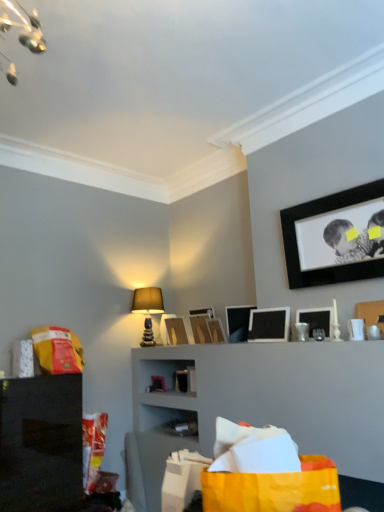
Question: Considering the positions of wooden picture frame at center, the 3th picture frame positioned from the back, and black matte picture frame at upper right, which appears as the eighth picture frame when viewed from the back, in the image, is wooden picture frame at center, the 3th picture frame positioned from the back, taller or shorter than black matte picture frame at upper right, which appears as the eighth picture frame when viewed from the back,?

Choices:
 (A) tall
 (B) short

Answer: (B)

Question: From a real-world perspective, is wooden picture frame at center, the 3th picture frame positioned from the back, above or below black matte picture frame at upper right, which appears as the eighth picture frame when viewed from the back?

Choices:
 (A) above
 (B) below

Answer: (B)

Question: Which object is positioned farthest from the matte black picture frame at upper right, which is the 3th picture frame from front to back?

Choices:
 (A) orange plastic bag at left, which ranks as the third shopping bag in right-to-left order
 (B) matte cardboard picture frame at center, which ranks as the second picture frame in back-to-front order
 (C) matte black picture frame at upper center, which is the 1th picture frame in back-to-front order
 (D) matte black picture frame at upper right, the 2th picture frame viewed from the front
 (E) matte black picture frame at upper center, the fourth picture frame positioned from the back

Answer: (A)

Question: Which is nearer to the yellow paper shopping bag at lower center, the second shopping bag from the front?

Choices:
 (A) orange plastic bag at left, which ranks as the third shopping bag in right-to-left order
 (B) matte black picture frame at upper center, the fourth picture frame positioned from the back
 (C) wooden picture frame at center, arranged as the fourth picture frame when viewed from the front
 (D) matte cardboard picture frame at center, which ranks as the second picture frame in back-to-front order
 (E) matte black picture frame at upper right, the 2th picture frame viewed from the front

Answer: (E)